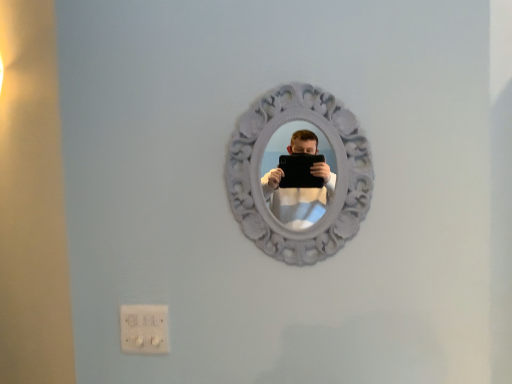
The height and width of the screenshot is (384, 512). Describe the element at coordinates (310, 169) in the screenshot. I see `white carved mirror at center` at that location.

At what (x,y) coordinates should I click in order to perform the action: click on white carved mirror at center. Please return your answer as a coordinate pair (x, y). This screenshot has width=512, height=384. Looking at the image, I should click on (310, 169).

This screenshot has width=512, height=384. What do you see at coordinates (144, 329) in the screenshot?
I see `white plastic electric outlet at lower left` at bounding box center [144, 329].

Find the location of a particular element. Image resolution: width=512 pixels, height=384 pixels. white plastic electric outlet at lower left is located at coordinates (144, 329).

This screenshot has height=384, width=512. Identify the location of white carved mirror at center. (310, 169).

Is white carved mirror at center to the left of white plastic electric outlet at lower left from the viewer's perspective?

In fact, white carved mirror at center is to the right of white plastic electric outlet at lower left.

In the image, is white carved mirror at center positioned in front of or behind white plastic electric outlet at lower left?

In the image, white carved mirror at center appears in front of white plastic electric outlet at lower left.

Which is behind, point (340, 215) or point (157, 309)?

Point (157, 309)

From the image's perspective, would you say white carved mirror at center is positioned over white plastic electric outlet at lower left?

Yes, from the image's perspective, white carved mirror at center is on top of white plastic electric outlet at lower left.

From a real-world perspective, between white carved mirror at center and white plastic electric outlet at lower left, who is vertically lower?

In real-world perspective, white plastic electric outlet at lower left is lower.

Between white carved mirror at center and white plastic electric outlet at lower left, which one has larger width?

With larger width is white carved mirror at center.

Can you confirm if white carved mirror at center is taller than white plastic electric outlet at lower left?

Correct, white carved mirror at center is much taller as white plastic electric outlet at lower left.

Considering the relative sizes of white carved mirror at center and white plastic electric outlet at lower left in the image provided, is white carved mirror at center smaller than white plastic electric outlet at lower left?

No.

Which is correct: white carved mirror at center is inside white plastic electric outlet at lower left, or outside of it?

white carved mirror at center is outside white plastic electric outlet at lower left.

Are white carved mirror at center and white plastic electric outlet at lower left beside each other?

No, white carved mirror at center is not next to white plastic electric outlet at lower left.

Is white carved mirror at center aimed at white plastic electric outlet at lower left?

No, white carved mirror at center is not oriented towards white plastic electric outlet at lower left.

Looking at this image, what's the angular difference between white carved mirror at center and white plastic electric outlet at lower left's facing directions?

There is a 0.307-degree angle between the facing directions of white carved mirror at center and white plastic electric outlet at lower left.

Locate an element on the screen. This screenshot has width=512, height=384. view mirror lying in front of the white plastic electric outlet at lower left is located at coordinates (310, 169).

Is white plastic electric outlet at lower left at the left side of white carved mirror at center?

Yes.

Between white plastic electric outlet at lower left and white carved mirror at center, which one is positioned in front?

white carved mirror at center is in front.

Is point (148, 351) closer or farther from the camera than point (329, 159)?

Point (148, 351).

From the image's perspective, is white plastic electric outlet at lower left located above or below white carved mirror at center?

white plastic electric outlet at lower left is situated lower than white carved mirror at center in the image.

From a real-world perspective, relative to white carved mirror at center, is white plastic electric outlet at lower left vertically above or below?

From a real-world perspective, white plastic electric outlet at lower left is physically below white carved mirror at center.

Which object is thinner, white plastic electric outlet at lower left or white carved mirror at center?

Thinner between the two is white plastic electric outlet at lower left.

Does white plastic electric outlet at lower left have a lesser height compared to white carved mirror at center?

Correct, white plastic electric outlet at lower left is not as tall as white carved mirror at center.

Considering the sizes of white plastic electric outlet at lower left and white carved mirror at center in the image, is white plastic electric outlet at lower left bigger or smaller than white carved mirror at center?

Considering their sizes, white plastic electric outlet at lower left takes up less space than white carved mirror at center.

Based on the photo, is white plastic electric outlet at lower left inside or outside of white carved mirror at center?

white plastic electric outlet at lower left cannot be found inside white carved mirror at center.

Is there a large distance between white plastic electric outlet at lower left and white carved mirror at center?

Actually, white plastic electric outlet at lower left and white carved mirror at center are a little close together.

Is white carved mirror at center at the back of white plastic electric outlet at lower left?

white plastic electric outlet at lower left is not turned away from white carved mirror at center.

What's the angular difference between white plastic electric outlet at lower left and white carved mirror at center's facing directions?

The facing directions of white plastic electric outlet at lower left and white carved mirror at center are 0.307 degrees apart.

You are a GUI agent. You are given a task and a screenshot of the screen. Output one action in this format:
    pyautogui.click(x=<x>, y=<y>)
    Task: Click on the electric outlet located on the left of white carved mirror at center
    
    Given the screenshot: What is the action you would take?
    pyautogui.click(x=144, y=329)

The image size is (512, 384). What are the coordinates of `view mirror in front of the white plastic electric outlet at lower left` in the screenshot? It's located at (310, 169).

Locate an element on the screen. view mirror located on the right of white plastic electric outlet at lower left is located at coordinates (310, 169).